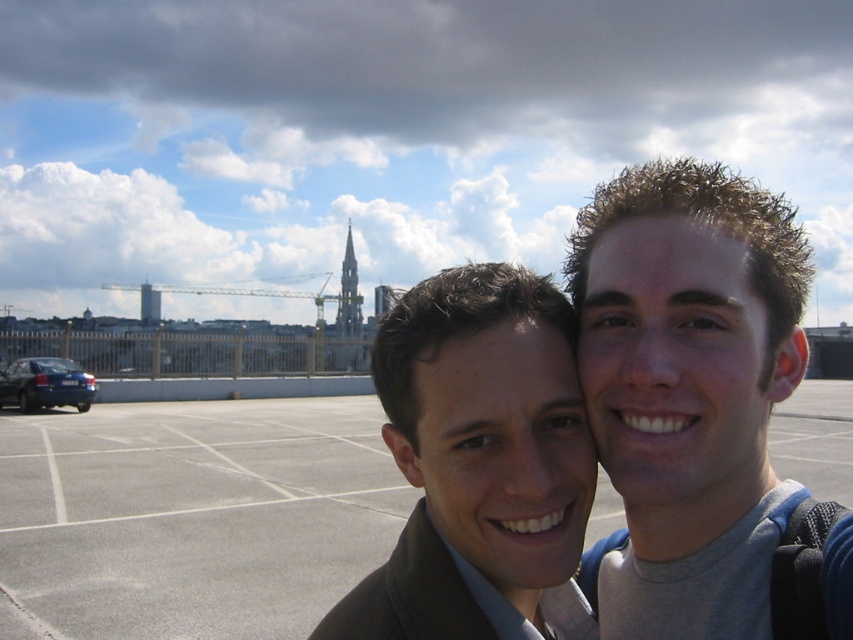
Question: Among these points, which one is nearest to the camera?

Choices:
 (A) (572, 312)
 (B) (175, 445)
 (C) (41, 392)
 (D) (648, 182)

Answer: (D)

Question: Is matte brown jacket at center bigger than gray concrete parking lot at center?

Choices:
 (A) yes
 (B) no

Answer: (A)

Question: Can you confirm if matte brown jacket at center is positioned below matte black jacket at center?

Choices:
 (A) yes
 (B) no

Answer: (B)

Question: Which point is farther to the camera?

Choices:
 (A) (584, 468)
 (B) (204, 508)

Answer: (B)

Question: Is the position of matte brown jacket at center more distant than that of blue metallic sedan at lower left?

Choices:
 (A) no
 (B) yes

Answer: (A)

Question: Which object is positioned farthest from the gray concrete parking lot at center?

Choices:
 (A) matte brown jacket at center
 (B) blue metallic sedan at lower left

Answer: (A)